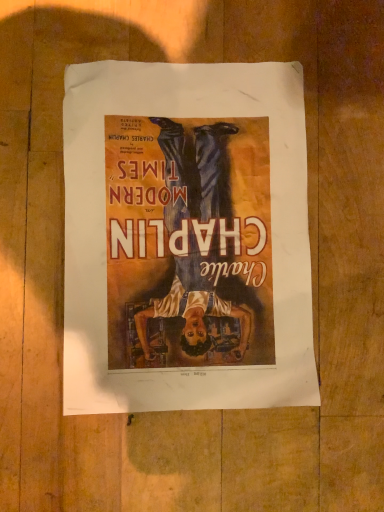
The height and width of the screenshot is (512, 384). What are the coordinates of `matte paper poster at center` in the screenshot? It's located at (186, 238).

The image size is (384, 512). What do you see at coordinates (186, 238) in the screenshot?
I see `matte paper poster at center` at bounding box center [186, 238].

I want to click on matte paper poster at center, so click(186, 238).